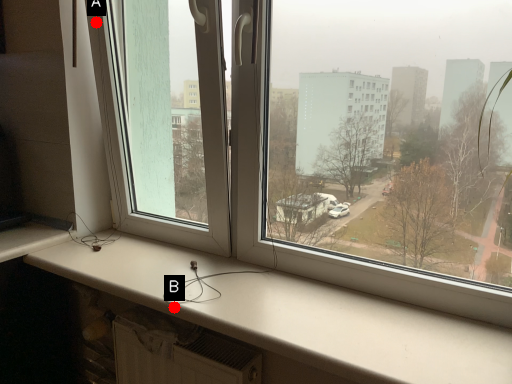
Question: Two points are circled on the image, labeled by A and B beside each circle. Which point is closer to the camera taking this photo?

Choices:
 (A) A is closer
 (B) B is closer

Answer: (B)